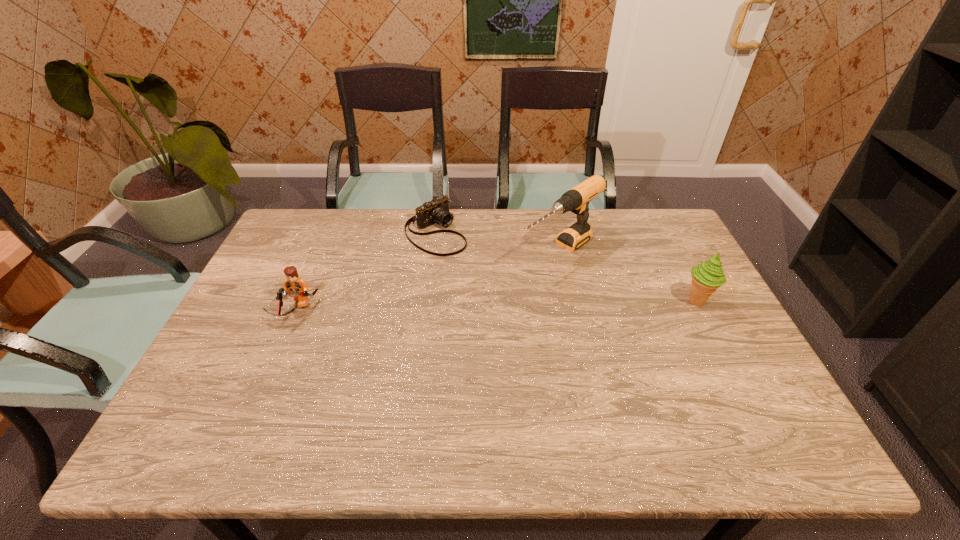
The image size is (960, 540). What are the coordinates of `vacant space on the desktop that is between the leftmost object and the icecream and is positioned on the handle side of the second object from right to left` in the screenshot? It's located at (481, 306).

The width and height of the screenshot is (960, 540). Find the location of `free spot on the desktop that is between the leftmost object and the rightmost object and is positioned on the front-facing side of the third object from right to left`. free spot on the desktop that is between the leftmost object and the rightmost object and is positioned on the front-facing side of the third object from right to left is located at coordinates (537, 305).